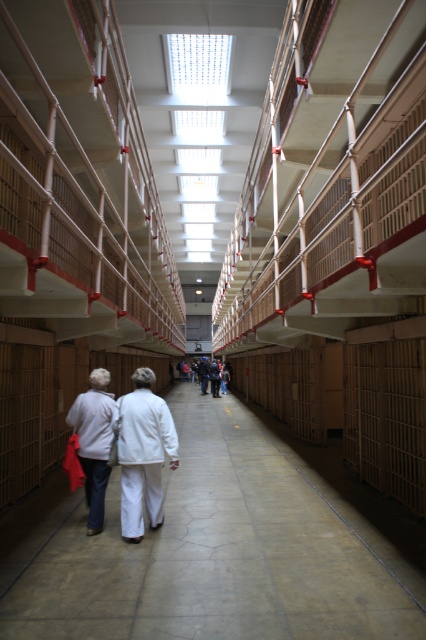
You are standing in the historic prison corridor and see the white fabric pants at center and the dark gray sweater at center. Which item is nearer to you?

The white fabric pants at center is closer to the viewer than the dark gray sweater at center.

You are an escape artist planning to slip through a narrow gap in the prison corridor. You have two items available to use as a distraction or tool, the white fabric pants at center and the dark gray sweater at center. Which item would be more suitable for your plan based on their sizes?

The white fabric pants at center has a smaller width than the dark gray sweater at center, making it more suitable for slipping through narrow gaps due to its narrower size.

You are standing in the historic prison corridor and want to move from one point to another. If you start at point (121, 476) and walk towards point (86, 433), will you be moving away from the camera or towards it?

Since point (121, 476) is closer to the camera than point (86, 433), walking from point (121, 476) towards point (86, 433) would mean moving away from the camera.